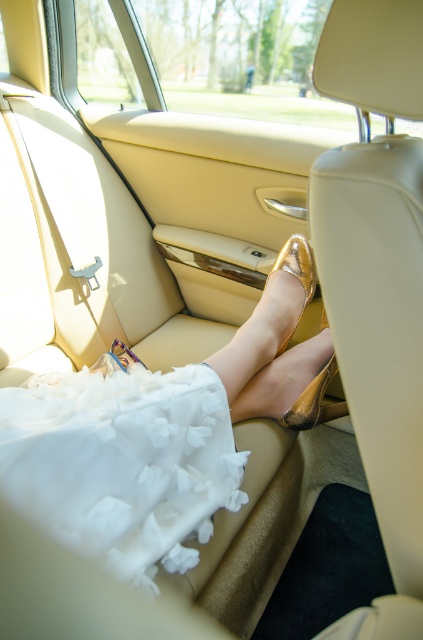
Is metallic gold shoe at center below white fluffy dress at lower left?

Incorrect, metallic gold shoe at center is not positioned below white fluffy dress at lower left.

Can you confirm if metallic gold shoe at center is wider than white fluffy dress at lower left?

Indeed, metallic gold shoe at center has a greater width compared to white fluffy dress at lower left.

Is point (288, 353) less distant than point (29, 461)?

No, (288, 353) is further to viewer.

Locate an element on the screen. The height and width of the screenshot is (640, 423). metallic gold shoe at center is located at coordinates (154, 436).